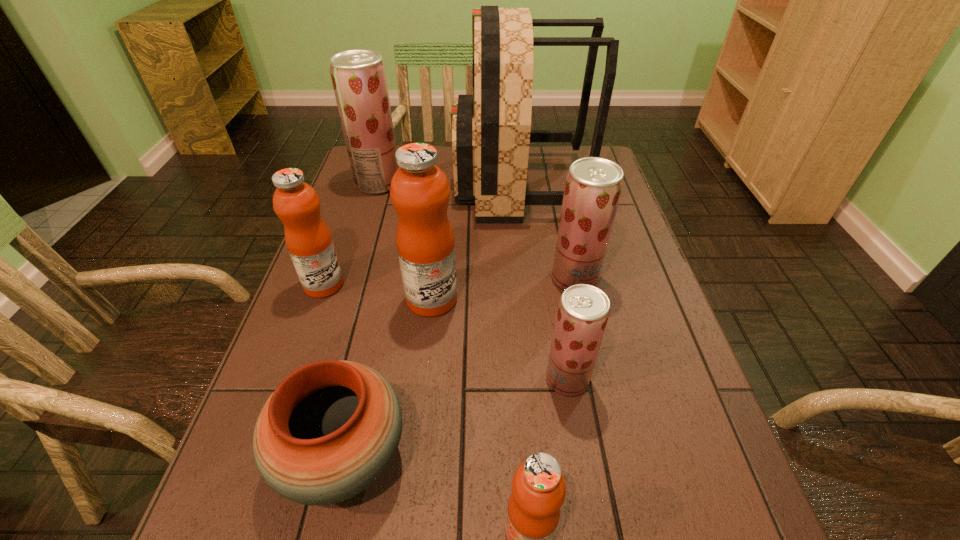
At what (x,y) coordinates should I click in order to perform the action: click on free space between the red pottery and the farthest strawberry fruit juice. Please return your answer as a coordinate pair (x, y). Looking at the image, I should click on (361, 320).

Where is `unoccupied position between the shortest object and the second smallest strawberry fruit juice`? The height and width of the screenshot is (540, 960). unoccupied position between the shortest object and the second smallest strawberry fruit juice is located at coordinates (460, 367).

Locate an element on the screen. This screenshot has height=540, width=960. vacant space that's between the smallest strawberry fruit juice and the biggest orange fruit juice is located at coordinates (499, 339).

Where is `free spot between the red pottery and the second orange fruit juice from left to right`? free spot between the red pottery and the second orange fruit juice from left to right is located at coordinates coord(388,377).

Identify which object is the closest to the leftmost orange fruit juice. Please provide its 2D coordinates. Your answer should be formatted as a tuple, i.e. [(x, y)], where the tuple contains the x and y coordinates of a point satisfying the conditions above.

[(420, 192)]

Locate which object is the fifth closest to the fourth fruit juice from left to right. Please provide its 2D coordinates. Your answer should be formatted as a tuple, i.e. [(x, y)], where the tuple contains the x and y coordinates of a point satisfying the conditions above.

[(308, 239)]

Locate an element on the screen. The height and width of the screenshot is (540, 960). fruit juice that is the second closest to the nearest fruit juice is located at coordinates (420, 192).

You are a GUI agent. You are given a task and a screenshot of the screen. Output one action in this format:
    pyautogui.click(x=<x>, y=<y>)
    Task: Click on the second closest fruit juice to the tallest object
    The image size is (960, 540).
    Given the screenshot: What is the action you would take?
    pyautogui.click(x=358, y=76)

Locate which strawberry fruit juice ranks third in proximity to the second orange fruit juice from left to right. Please provide its 2D coordinates. Your answer should be formatted as a tuple, i.e. [(x, y)], where the tuple contains the x and y coordinates of a point satisfying the conditions above.

[(358, 76)]

Select which strawberry fruit juice is the third closest to the pottery. Please provide its 2D coordinates. Your answer should be formatted as a tuple, i.e. [(x, y)], where the tuple contains the x and y coordinates of a point satisfying the conditions above.

[(358, 76)]